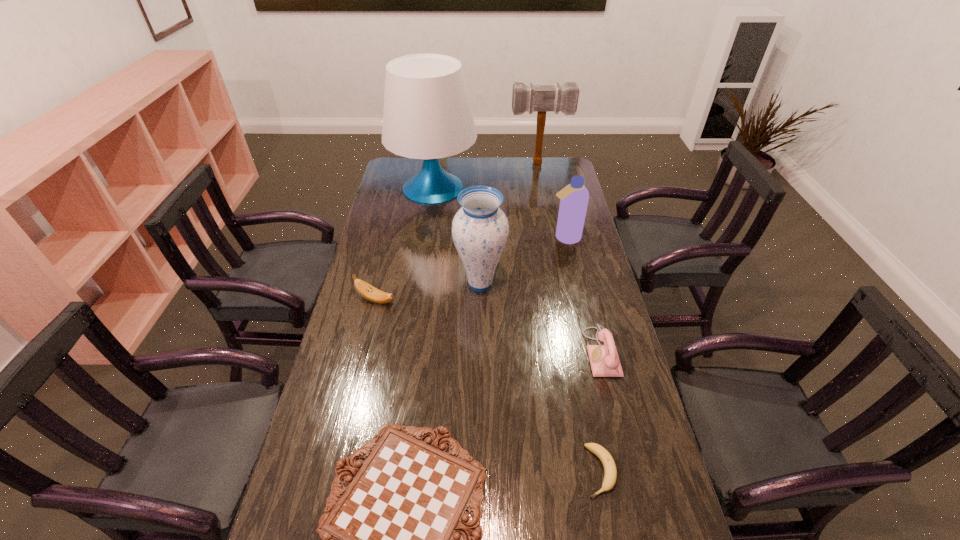
Identify the location of the tallest object. (427, 115).

Where is `mallet`? mallet is located at coordinates (530, 98).

Where is `vase`? Image resolution: width=960 pixels, height=540 pixels. vase is located at coordinates (480, 229).

Find the location of `the fifth shortest object`. the fifth shortest object is located at coordinates (574, 197).

Find the location of a particular element. This screenshot has height=540, width=960. shampoo is located at coordinates (574, 197).

The height and width of the screenshot is (540, 960). Find the location of `telephone`. telephone is located at coordinates (604, 360).

I want to click on the left banana, so click(366, 290).

Locate an element on the screen. the farther banana is located at coordinates (366, 290).

Locate an element on the screen. Image resolution: width=960 pixels, height=540 pixels. the second shortest object is located at coordinates (610, 472).

Locate an element on the screen. The width and height of the screenshot is (960, 540). the shorter banana is located at coordinates (610, 472).